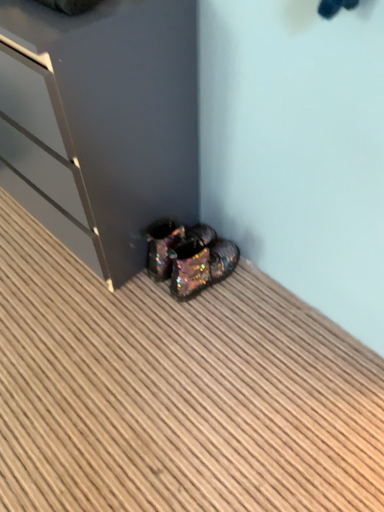
Locate an element on the screen. Image resolution: width=384 pixels, height=512 pixels. vacant area that lies in front of iridescent glittery shoes at lower center is located at coordinates (213, 324).